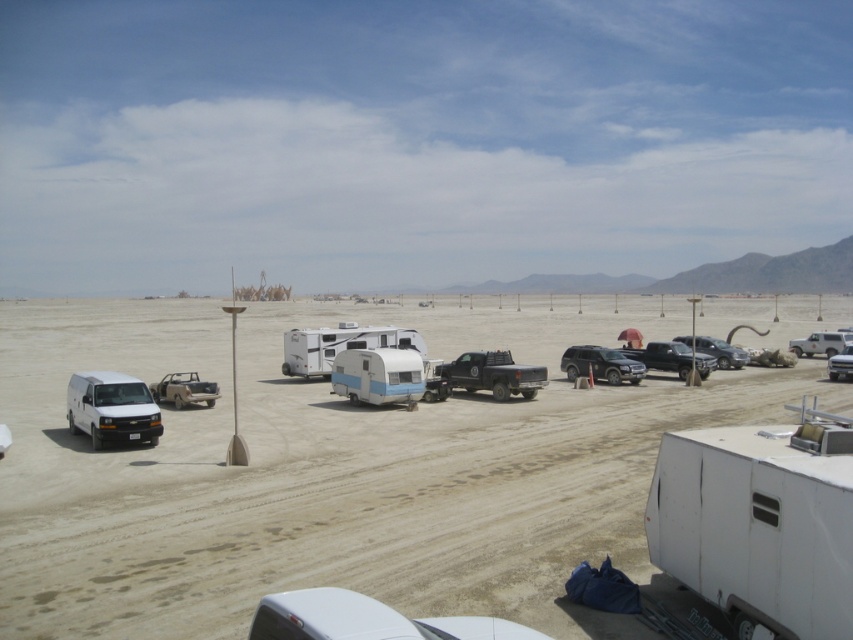
Between matte black truck at center and white matte truck at right, which one appears on the right side from the viewer's perspective?

From the viewer's perspective, white matte truck at right appears more on the right side.

Does matte black truck at center have a larger size compared to white matte truck at right?

Yes, matte black truck at center is bigger than white matte truck at right.

Is point (531, 372) more distant than point (827, 344)?

No, it is in front of (827, 344).

Find the location of a particular element. matte black truck at center is located at coordinates (492, 374).

Where is `white matte van at left`? white matte van at left is located at coordinates (111, 408).

Is white matte van at left to the left of metallic silver truck at center from the viewer's perspective?

Correct, you'll find white matte van at left to the left of metallic silver truck at center.

Locate an element on the screen. Image resolution: width=853 pixels, height=640 pixels. white matte van at left is located at coordinates (111, 408).

Which is behind, point (305, 339) or point (523, 365)?

The point (523, 365) is behind.

This screenshot has height=640, width=853. In order to click on white plastic camper at center in this screenshot , I will do `click(340, 346)`.